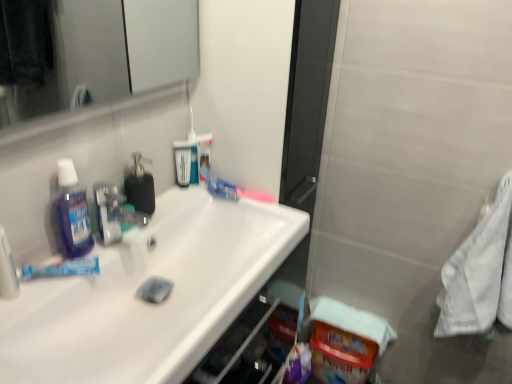
The image size is (512, 384). Identify the location of vacant space in between blue glossy mouthwash at upper center, which appears as the second mouthwash when viewed from the left, and black rubber soap dispenser at center. (169, 200).